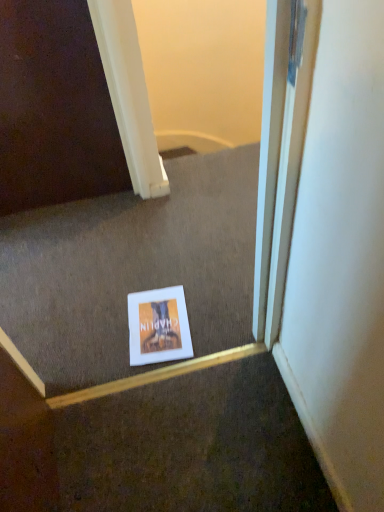
Find the location of a particular element. The image size is (384, 512). white paper at center is located at coordinates (131, 270).

Image resolution: width=384 pixels, height=512 pixels. Describe the element at coordinates (131, 270) in the screenshot. I see `white paper at center` at that location.

Measure the distance between point [158,216] and camera.

Point [158,216] is 6.09 feet away from camera.

The width and height of the screenshot is (384, 512). Describe the element at coordinates (158, 326) in the screenshot. I see `matte cardboard book at center` at that location.

The height and width of the screenshot is (512, 384). In order to click on matte cardboard book at center in this screenshot , I will do `click(158, 326)`.

This screenshot has width=384, height=512. Identify the location of white paper at center. (131, 270).

From the picture: Considering the positions of objects white paper at center and matte cardboard book at center in the image provided, who is more to the left, white paper at center or matte cardboard book at center?

white paper at center is more to the left.

Which object is further away from the camera, white paper at center or matte cardboard book at center?

matte cardboard book at center is further from the camera.

Considering the points (74, 294) and (148, 324), which point is in front, point (74, 294) or point (148, 324)?

The point (148, 324) is in front.

From the image's perspective, which one is positioned lower, white paper at center or matte cardboard book at center?

matte cardboard book at center is shown below in the image.

From a real-world perspective, relative to matte cardboard book at center, is white paper at center vertically above or below?

white paper at center is situated higher than matte cardboard book at center in the real world.

Can you confirm if white paper at center is wider than matte cardboard book at center?

Yes.

Considering the sizes of white paper at center and matte cardboard book at center in the image, is white paper at center taller or shorter than matte cardboard book at center?

Considering their sizes, white paper at center has more height than matte cardboard book at center.

Which of these two, white paper at center or matte cardboard book at center, is smaller?

matte cardboard book at center is smaller.

Is white paper at center situated inside matte cardboard book at center or outside?

white paper at center is outside matte cardboard book at center.

Are white paper at center and matte cardboard book at center far apart?

Actually, white paper at center and matte cardboard book at center are a little close together.

Is white paper at center oriented towards matte cardboard book at center?

Yes, white paper at center faces towards matte cardboard book at center.

What's the angular difference between white paper at center and matte cardboard book at center's facing directions?

5.01 degrees separate the facing orientations of white paper at center and matte cardboard book at center.

Measure the distance between white paper at center and matte cardboard book at center.

white paper at center and matte cardboard book at center are 10.40 inches apart.

Locate an element on the screen. The height and width of the screenshot is (512, 384). stairwell that is in front of the matte cardboard book at center is located at coordinates (131, 270).

Between matte cardboard book at center and white paper at center, which one appears on the right side from the viewer's perspective?

Positioned to the right is matte cardboard book at center.

Is the depth of matte cardboard book at center greater than that of white paper at center?

Yes.

Does point (178, 357) come closer to viewer compared to point (83, 329)?

That is True.

From the image's perspective, is matte cardboard book at center under white paper at center?

Yes, from the image's perspective, matte cardboard book at center is below white paper at center.

From a real-world perspective, who is located higher, matte cardboard book at center or white paper at center?

white paper at center is physically above.

Considering the relative sizes of matte cardboard book at center and white paper at center in the image provided, is matte cardboard book at center wider than white paper at center?

No, matte cardboard book at center is not wider than white paper at center.

Considering the sizes of matte cardboard book at center and white paper at center in the image, is matte cardboard book at center taller or shorter than white paper at center?

Clearly, matte cardboard book at center is shorter compared to white paper at center.

Is matte cardboard book at center smaller than white paper at center?

Correct, matte cardboard book at center occupies less space than white paper at center.

Do you think matte cardboard book at center is within white paper at center, or outside of it?

matte cardboard book at center is inside white paper at center.

Does matte cardboard book at center touch white paper at center?

No, matte cardboard book at center is not beside white paper at center.

Is matte cardboard book at center turned away from white paper at center?

Absolutely, matte cardboard book at center is directed away from white paper at center.

Consider the image. How many degrees apart are the facing directions of matte cardboard book at center and white paper at center?

There is a 5.01-degree angle between the facing directions of matte cardboard book at center and white paper at center.

Identify the location of stairwell that appears above the matte cardboard book at center (from the image's perspective). This screenshot has height=512, width=384. (131, 270).

What are the coordinates of `picture frame lying below the white paper at center (from the image's perspective)` in the screenshot? It's located at (158, 326).

Where is `picture frame that is on the right side of white paper at center`? picture frame that is on the right side of white paper at center is located at coordinates (158, 326).